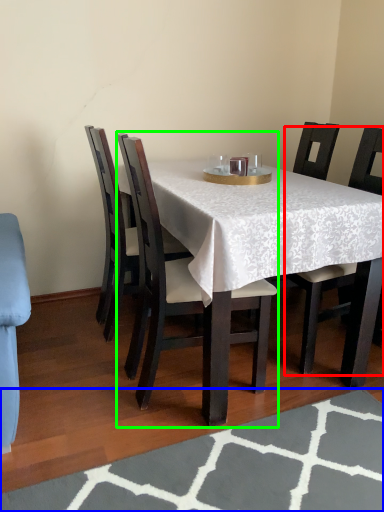
Question: Estimate the real-world distances between objects in this image. Which object is farther from chair (highlighted by a red box), place mat (highlighted by a blue box) or chair (highlighted by a green box)?

Choices:
 (A) place mat
 (B) chair

Answer: (A)